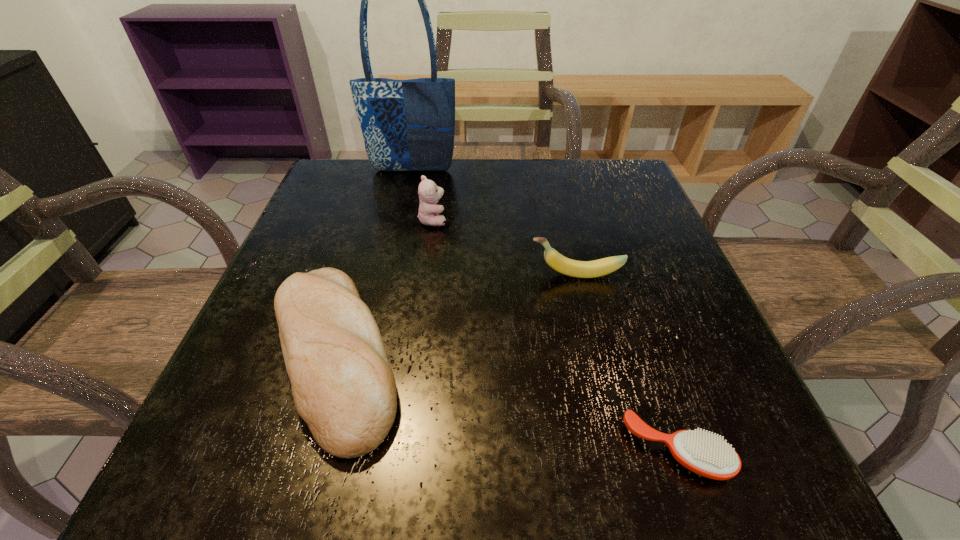
Locate an element on the screen. Image resolution: width=960 pixels, height=540 pixels. hairbrush that is at the right edge is located at coordinates (705, 454).

You are a GUI agent. You are given a task and a screenshot of the screen. Output one action in this format:
    pyautogui.click(x=<x>, y=<y>)
    Task: Click on the object that is at the far left corner
    Image resolution: width=960 pixels, height=540 pixels.
    Given the screenshot: What is the action you would take?
    pyautogui.click(x=408, y=125)

What are the coordinates of `object at the near left corner` in the screenshot? It's located at (343, 386).

Find the location of a particular element. object located at the near right corner is located at coordinates (705, 454).

Where is `free location at the far edge`? free location at the far edge is located at coordinates (538, 202).

Identify the location of free location at the near edge. This screenshot has height=540, width=960. (313, 476).

The height and width of the screenshot is (540, 960). I want to click on vacant space at the left edge of the desktop, so click(317, 246).

In the image, there is a desktop. At what (x,y) coordinates should I click in order to perform the action: click on vacant space at the right edge. Please return your answer as a coordinate pair (x, y). The height and width of the screenshot is (540, 960). Looking at the image, I should click on (625, 330).

Where is `vacant space at the far left corner of the desktop`? The width and height of the screenshot is (960, 540). vacant space at the far left corner of the desktop is located at coordinates (304, 210).

Where is `vacant space at the near left corner of the desktop`? This screenshot has height=540, width=960. vacant space at the near left corner of the desktop is located at coordinates (206, 454).